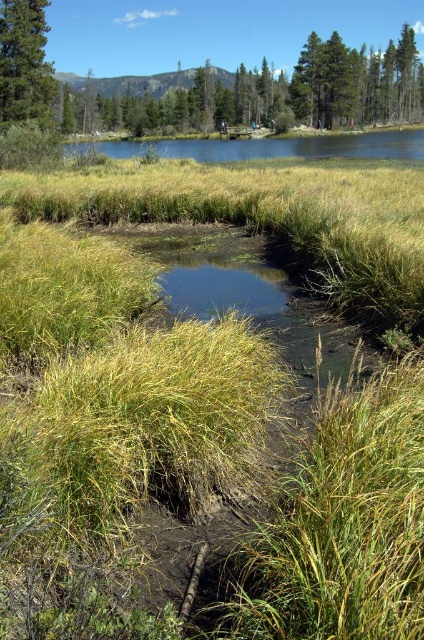
Between green leafy tree at upper center and green matte tree at upper left, which one appears on the right side from the viewer's perspective?

Positioned to the right is green leafy tree at upper center.

Can you confirm if green leafy tree at upper center is positioned to the left of green matte tree at upper left?

In fact, green leafy tree at upper center is to the right of green matte tree at upper left.

Is point (273, 106) behind point (22, 97)?

Yes, it is behind point (22, 97).

Find the location of a particular element. green leafy tree at upper center is located at coordinates (259, 92).